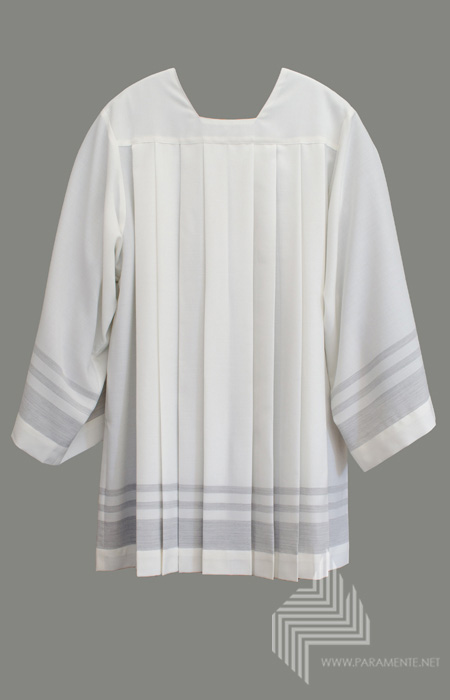
At what (x,y) coordinates should I click in order to perform the action: click on grey wall. Please return your answer as a coordinate pair (x, y). The image size is (450, 700). Looking at the image, I should click on (122, 607).